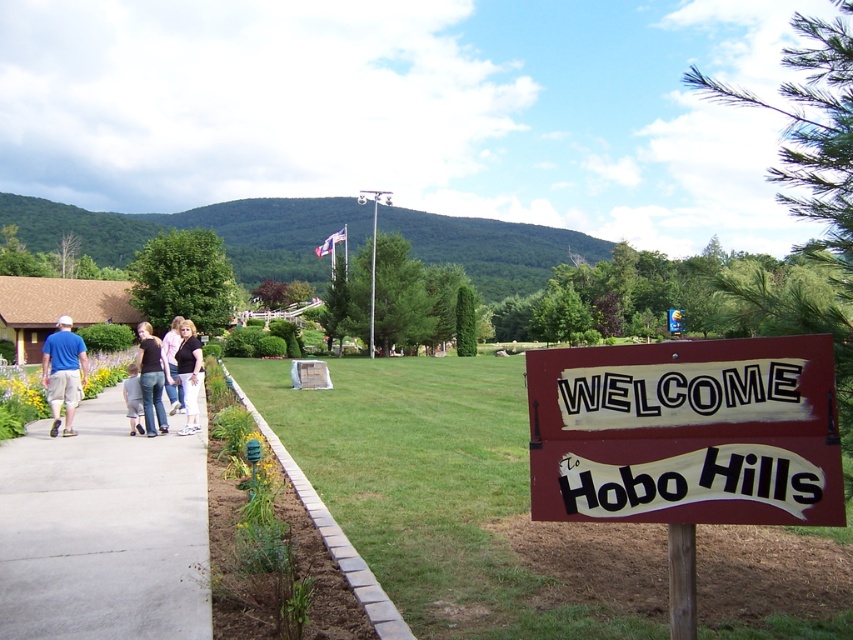
Question: Which point is closer to the camera?

Choices:
 (A) (111, 572)
 (B) (193, 326)
 (C) (143, 332)
 (D) (665, 353)

Answer: (D)

Question: Can you confirm if denim jeans at left is positioned above matte black shirt at center?

Choices:
 (A) yes
 (B) no

Answer: (B)

Question: Can you confirm if gray concrete sidewalk at lower left is bigger than matte blue shirt at left?

Choices:
 (A) no
 (B) yes

Answer: (A)

Question: Which object appears farthest from the camera in this image?

Choices:
 (A) gray concrete sidewalk at lower left
 (B) matte black shirt at center
 (C) denim jeans at left

Answer: (B)

Question: Is denim jeans at left to the left of matte black shirt at center from the viewer's perspective?

Choices:
 (A) yes
 (B) no

Answer: (A)

Question: Which object is closer to the camera taking this photo?

Choices:
 (A) matte blue shirt at left
 (B) denim pants at left
 (C) matte black shirt at center

Answer: (A)